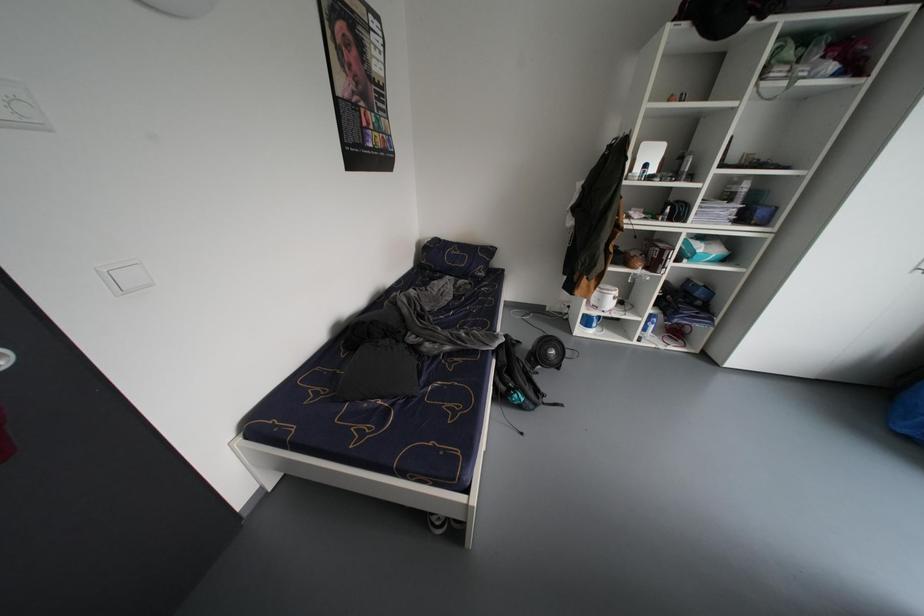
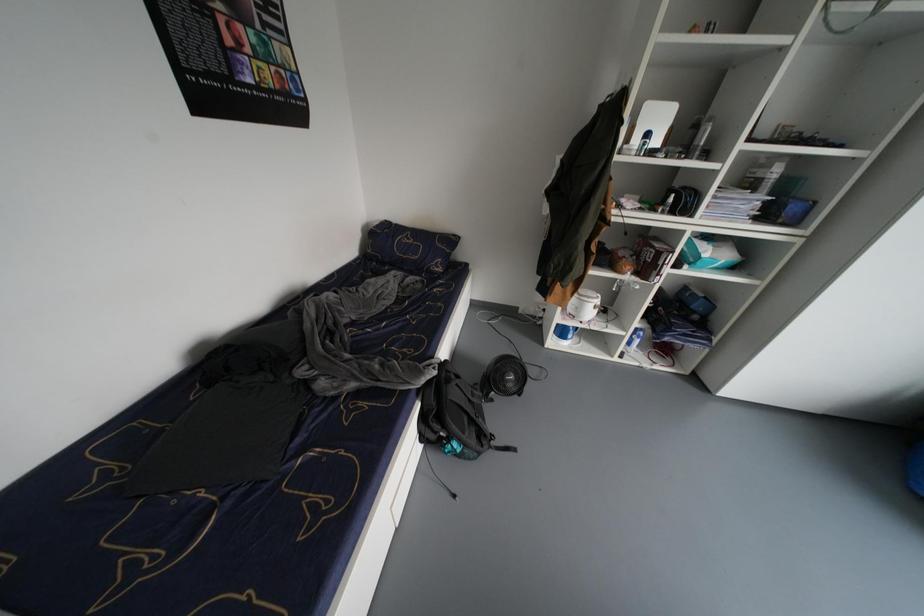
Question: Based on the continuous images, in which direction is the camera rotating? Reply with the corresponding letter.

Choices:
 (A) Left
 (B) Right
 (C) Up
 (D) Down

Answer: (D)